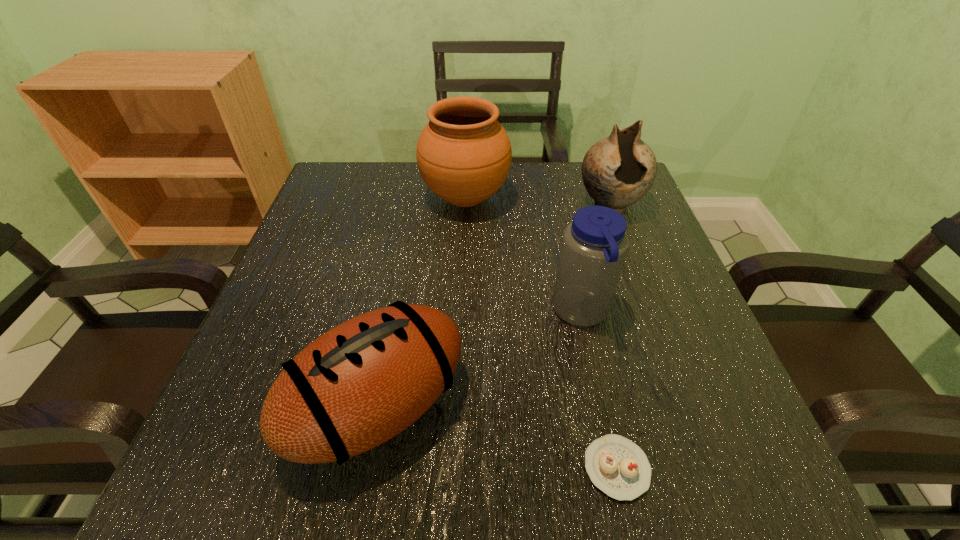
You are a GUI agent. You are given a task and a screenshot of the screen. Output one action in this format:
    pyautogui.click(x=<x>, y=<y>)
    Task: Click on the vacant space at the near edge of the desktop
    
    Given the screenshot: What is the action you would take?
    pyautogui.click(x=408, y=444)

The height and width of the screenshot is (540, 960). In the image, there is a desktop. What are the coordinates of `free space at the left edge` in the screenshot? It's located at (301, 312).

The height and width of the screenshot is (540, 960). I want to click on vacant area at the right edge, so click(x=652, y=326).

You are a GUI agent. You are given a task and a screenshot of the screen. Output one action in this format:
    pyautogui.click(x=<x>, y=<y>)
    Task: Click on the vacant space at the near right corner of the desktop
    The image size is (960, 540).
    Given the screenshot: What is the action you would take?
    pyautogui.click(x=675, y=494)

At what (x,y) coordinates should I click in order to perform the action: click on vacant point located between the football (American) and the right pottery. Please return your answer as a coordinate pair (x, y). Looking at the image, I should click on (494, 306).

Locate an element on the screen. The height and width of the screenshot is (540, 960). free spot between the water bottle and the football (American) is located at coordinates (480, 360).

Find the location of `free space that is in between the shortest object and the third nearest object`. free space that is in between the shortest object and the third nearest object is located at coordinates (599, 390).

Locate an element on the screen. empty space that is in between the left pottery and the water bottle is located at coordinates (523, 255).

Locate an element on the screen. This screenshot has height=540, width=960. free area in between the left pottery and the shortest object is located at coordinates (541, 333).

The height and width of the screenshot is (540, 960). I want to click on vacant space that is in between the left pottery and the football (American), so click(x=421, y=303).